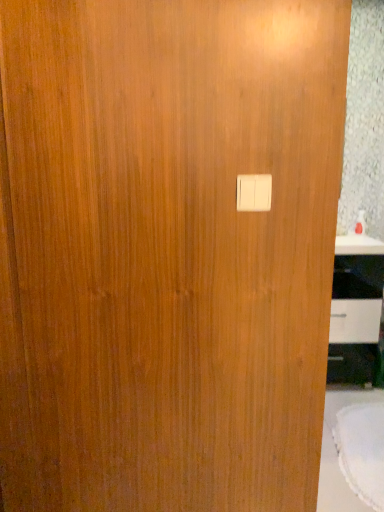
Question: Does white glossy cabinet at right appear on the right side of white fabric table at lower right?

Choices:
 (A) yes
 (B) no

Answer: (A)

Question: Is white glossy cabinet at right to the left of white fabric table at lower right from the viewer's perspective?

Choices:
 (A) yes
 (B) no

Answer: (B)

Question: Are white glossy cabinet at right and white fabric table at lower right located far from each other?

Choices:
 (A) yes
 (B) no

Answer: (B)

Question: Does white glossy cabinet at right have a lesser height compared to white fabric table at lower right?

Choices:
 (A) yes
 (B) no

Answer: (B)

Question: Does white glossy cabinet at right have a greater height compared to white fabric table at lower right?

Choices:
 (A) no
 (B) yes

Answer: (B)

Question: From a real-world perspective, does white glossy cabinet at right sit lower than white fabric table at lower right?

Choices:
 (A) no
 (B) yes

Answer: (A)

Question: Is white glossy cabinet at right surrounded by white plastic light switch at center?

Choices:
 (A) no
 (B) yes

Answer: (A)

Question: Can you confirm if white plastic light switch at center is positioned to the left of white glossy cabinet at right?

Choices:
 (A) no
 (B) yes

Answer: (B)

Question: Can you confirm if white plastic light switch at center is smaller than white glossy cabinet at right?

Choices:
 (A) no
 (B) yes

Answer: (B)

Question: Considering the relative sizes of white plastic light switch at center and white glossy cabinet at right in the image provided, is white plastic light switch at center thinner than white glossy cabinet at right?

Choices:
 (A) no
 (B) yes

Answer: (B)

Question: From the image's perspective, is white plastic light switch at center over white glossy cabinet at right?

Choices:
 (A) no
 (B) yes

Answer: (B)

Question: From a real-world perspective, does white plastic light switch at center stand above white glossy cabinet at right?

Choices:
 (A) no
 (B) yes

Answer: (B)

Question: From the image's perspective, is white fabric table at lower right on top of white plastic light switch at center?

Choices:
 (A) yes
 (B) no

Answer: (B)